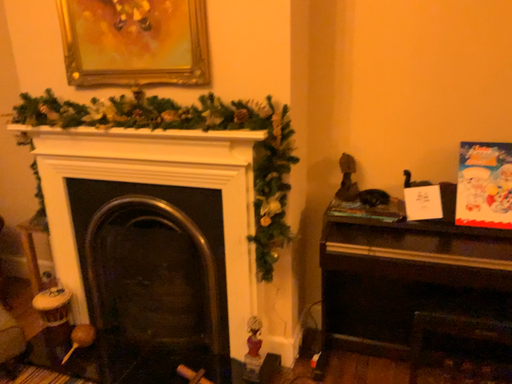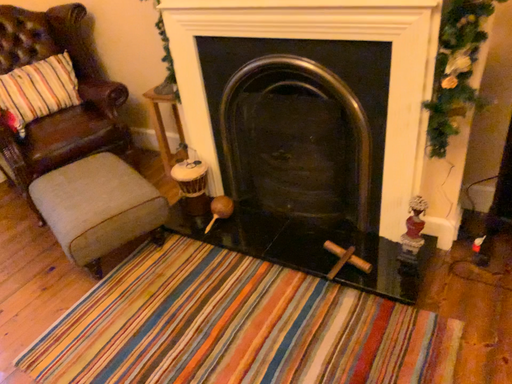
Question: Which way did the camera rotate in the video?

Choices:
 (A) rotated upward
 (B) rotated downward

Answer: (B)